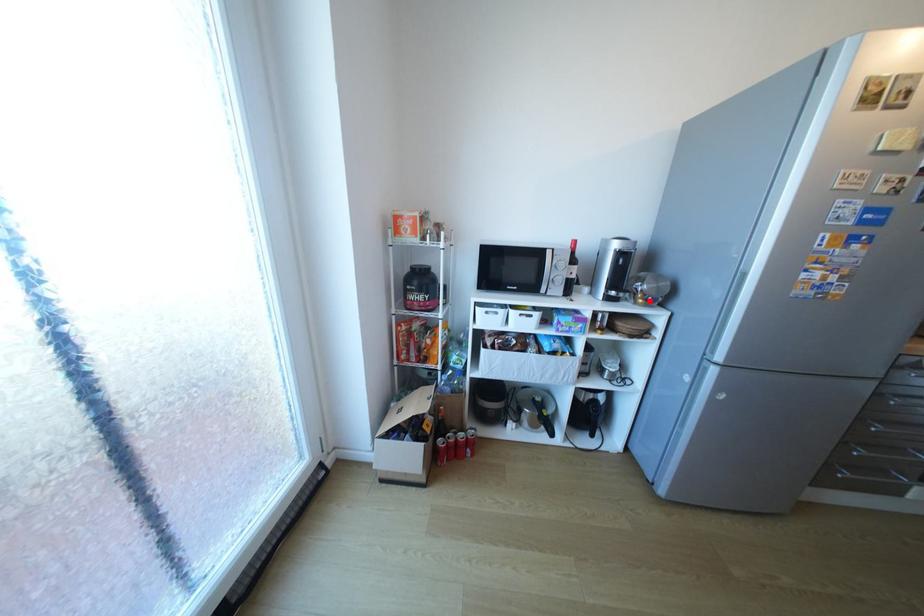
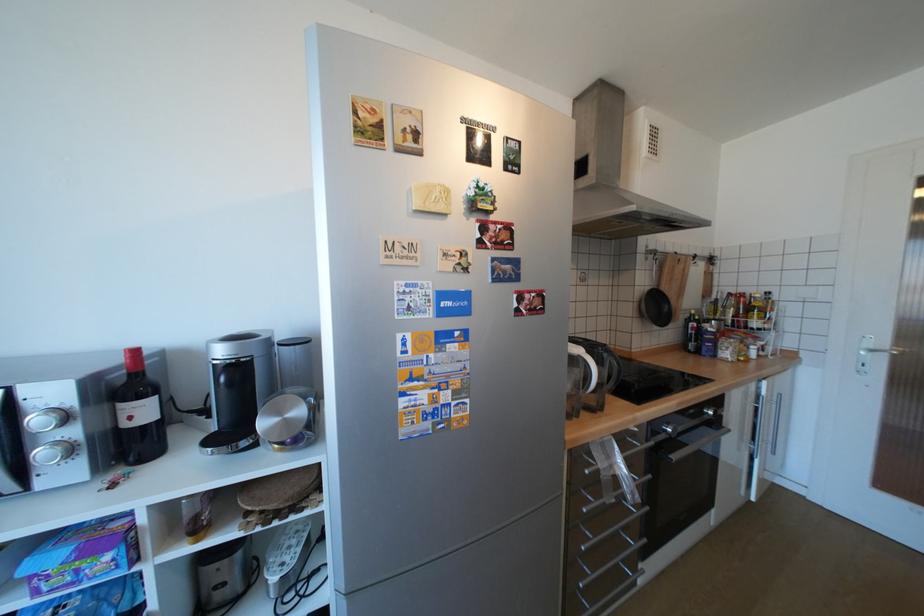
Question: I am providing you with two images of the same scene from different viewpoints. Image1 has a red point marked. In image2, the corresponding 3D location appears at what relative position? Reply with the corresponding letter.

Choices:
 (A) Closer
 (B) Farther

Answer: (B)